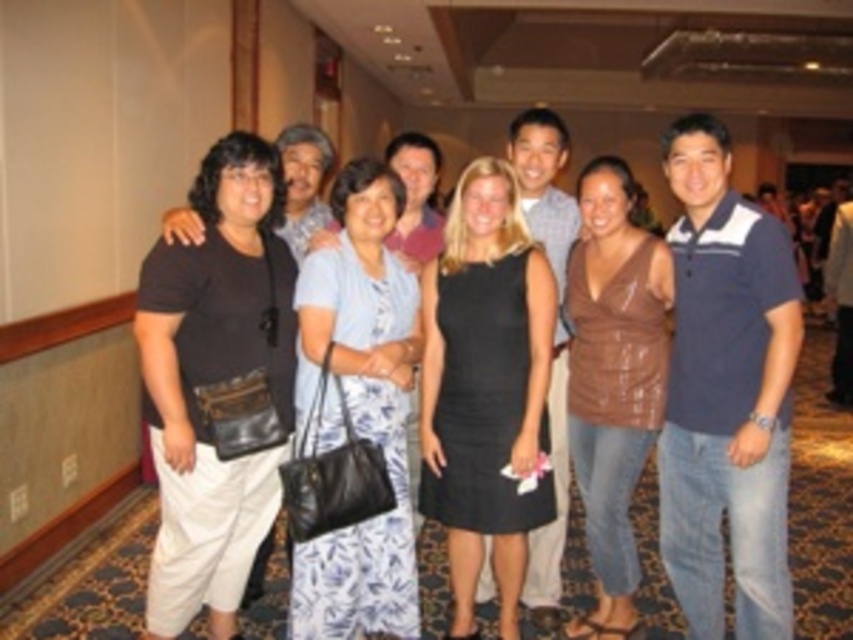
Can you confirm if light blue floral dress at center is positioned above brown leather top at center?

Yes, light blue floral dress at center is above brown leather top at center.

Between point (293, 612) and point (607, 348), which one is positioned in front?

Point (293, 612) is in front.

Where is `light blue floral dress at center`? light blue floral dress at center is located at coordinates (358, 410).

Is black satin dress at center positioned in front of brown leather top at center?

That is True.

Between black satin dress at center and brown leather top at center, which one appears on the left side from the viewer's perspective?

From the viewer's perspective, black satin dress at center appears more on the left side.

Measure the distance between black satin dress at center and camera.

The distance of black satin dress at center from camera is 3.26 meters.

Identify the location of black satin dress at center. The height and width of the screenshot is (640, 853). (485, 387).

Can you confirm if black satin dress at center is smaller than light blue floral dress at center?

Yes.

Is black satin dress at center to the right of light blue floral dress at center from the viewer's perspective?

Indeed, black satin dress at center is positioned on the right side of light blue floral dress at center.

Between point (461, 433) and point (326, 260), which one is positioned in front?

Positioned in front is point (326, 260).

Image resolution: width=853 pixels, height=640 pixels. I want to click on black satin dress at center, so click(485, 387).